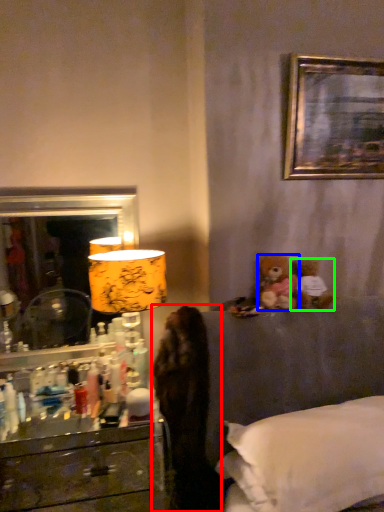
Question: Which object is the farthest from dark (highlighted by a red box)? Choose among these: teddy bear (highlighted by a blue box) or teddy bear (highlighted by a green box).

Choices:
 (A) teddy bear
 (B) teddy bear

Answer: (B)